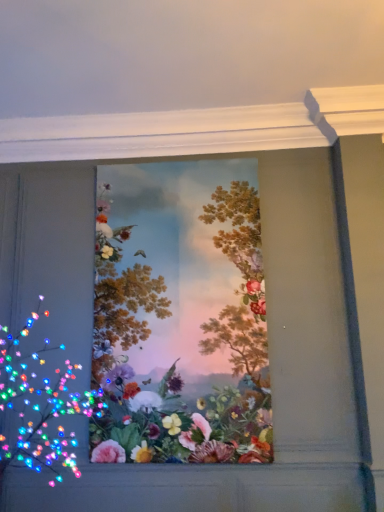
The height and width of the screenshot is (512, 384). In order to click on matte floral arrangement at left, which is counted as the first flower, starting from the front in this screenshot , I will do `click(38, 404)`.

Describe the element at coordinates (38, 404) in the screenshot. The height and width of the screenshot is (512, 384). I see `matte floral arrangement at left, which is counted as the first flower, starting from the front` at that location.

Measure the distance between matte floral arrangement at left, which is counted as the first flower, starting from the front, and camera.

A distance of 2.49 meters exists between matte floral arrangement at left, which is counted as the first flower, starting from the front, and camera.

How much space does matte floral arrangement at left, which is the second flower from back to front, occupy horizontally?

matte floral arrangement at left, which is the second flower from back to front, is 3.78 feet wide.

I want to click on vibrant floral bouquet at center, positioned as the 1th flower in back-to-front order, so click(179, 358).

In the scene shown: What is the approximate width of vibrant floral bouquet at center, the 2th flower when ordered from front to back?

The width of vibrant floral bouquet at center, the 2th flower when ordered from front to back, is 2.49 inches.

Image resolution: width=384 pixels, height=512 pixels. Describe the element at coordinates (179, 358) in the screenshot. I see `vibrant floral bouquet at center, positioned as the 1th flower in back-to-front order` at that location.

What is the approximate height of vibrant floral bouquet at center, the 2th flower when ordered from front to back?

7.84 feet.

Measure the distance between point (155, 451) and camera.

The depth of point (155, 451) is 3.15 meters.

Find the location of a particular element. The image size is (384, 512). matte floral arrangement at left, which is counted as the first flower, starting from the front is located at coordinates [38, 404].

Is vibrant floral bouquet at center, the 2th flower when ordered from front to back, at the right side of matte floral arrangement at left, which is counted as the first flower, starting from the front?

Indeed, vibrant floral bouquet at center, the 2th flower when ordered from front to back, is positioned on the right side of matte floral arrangement at left, which is counted as the first flower, starting from the front.

Is vibrant floral bouquet at center, the 2th flower when ordered from front to back, in front of or behind matte floral arrangement at left, which is the second flower from back to front, in the image?

vibrant floral bouquet at center, the 2th flower when ordered from front to back, is behind matte floral arrangement at left, which is the second flower from back to front.

Does point (104, 338) lie in front of point (8, 404)?

No, it is not.

From the image's perspective, between vibrant floral bouquet at center, the 2th flower when ordered from front to back, and matte floral arrangement at left, which is counted as the first flower, starting from the front, which one is located above?

vibrant floral bouquet at center, the 2th flower when ordered from front to back, appears higher in the image.

From a real-world perspective, which object rests below the other?

matte floral arrangement at left, which is the second flower from back to front, is physically lower.

Considering the sizes of vibrant floral bouquet at center, the 2th flower when ordered from front to back, and matte floral arrangement at left, which is the second flower from back to front, in the image, is vibrant floral bouquet at center, the 2th flower when ordered from front to back, wider or thinner than matte floral arrangement at left, which is the second flower from back to front,?

vibrant floral bouquet at center, the 2th flower when ordered from front to back, is thinner than matte floral arrangement at left, which is the second flower from back to front.

Considering the sizes of objects vibrant floral bouquet at center, positioned as the 1th flower in back-to-front order, and matte floral arrangement at left, which is the second flower from back to front, in the image provided, who is shorter, vibrant floral bouquet at center, positioned as the 1th flower in back-to-front order, or matte floral arrangement at left, which is the second flower from back to front,?

matte floral arrangement at left, which is the second flower from back to front.

Considering the sizes of objects vibrant floral bouquet at center, positioned as the 1th flower in back-to-front order, and matte floral arrangement at left, which is the second flower from back to front, in the image provided, who is bigger, vibrant floral bouquet at center, positioned as the 1th flower in back-to-front order, or matte floral arrangement at left, which is the second flower from back to front,?

matte floral arrangement at left, which is the second flower from back to front.

Is vibrant floral bouquet at center, the 2th flower when ordered from front to back, completely or partially outside of matte floral arrangement at left, which is the second flower from back to front?

Indeed, vibrant floral bouquet at center, the 2th flower when ordered from front to back, is completely outside matte floral arrangement at left, which is the second flower from back to front.

Is vibrant floral bouquet at center, positioned as the 1th flower in back-to-front order, positioned far away from matte floral arrangement at left, which is counted as the first flower, starting from the front?

No, vibrant floral bouquet at center, positioned as the 1th flower in back-to-front order, is not far away from matte floral arrangement at left, which is counted as the first flower, starting from the front.

Is vibrant floral bouquet at center, the 2th flower when ordered from front to back, looking in the opposite direction of matte floral arrangement at left, which is the second flower from back to front?

No.

What's the angular difference between vibrant floral bouquet at center, positioned as the 1th flower in back-to-front order, and matte floral arrangement at left, which is the second flower from back to front,'s facing directions?

There is a 90.3-degree angle between the facing directions of vibrant floral bouquet at center, positioned as the 1th flower in back-to-front order, and matte floral arrangement at left, which is the second flower from back to front.

At what (x,y) coordinates should I click in order to perform the action: click on flower beneath the vibrant floral bouquet at center, the 2th flower when ordered from front to back (from a real-world perspective). Please return your answer as a coordinate pair (x, y). The image size is (384, 512). Looking at the image, I should click on point(38,404).

Which object is positioned more to the left, matte floral arrangement at left, which is the second flower from back to front, or vibrant floral bouquet at center, positioned as the 1th flower in back-to-front order?

matte floral arrangement at left, which is the second flower from back to front.

Does matte floral arrangement at left, which is counted as the first flower, starting from the front, come in front of vibrant floral bouquet at center, the 2th flower when ordered from front to back?

Yes.

Which is behind, point (66, 466) or point (116, 261)?

The point (116, 261) is farther.

Looking at this image, from the image's perspective, would you say matte floral arrangement at left, which is counted as the first flower, starting from the front, is shown under vibrant floral bouquet at center, the 2th flower when ordered from front to back?

Correct, matte floral arrangement at left, which is counted as the first flower, starting from the front, appears lower than vibrant floral bouquet at center, the 2th flower when ordered from front to back, in the image.

From a real-world perspective, is matte floral arrangement at left, which is counted as the first flower, starting from the front, physically above vibrant floral bouquet at center, the 2th flower when ordered from front to back?

No.

Considering the sizes of objects matte floral arrangement at left, which is counted as the first flower, starting from the front, and vibrant floral bouquet at center, the 2th flower when ordered from front to back, in the image provided, who is thinner, matte floral arrangement at left, which is counted as the first flower, starting from the front, or vibrant floral bouquet at center, the 2th flower when ordered from front to back,?

With smaller width is vibrant floral bouquet at center, the 2th flower when ordered from front to back.

Does matte floral arrangement at left, which is the second flower from back to front, have a greater height compared to vibrant floral bouquet at center, the 2th flower when ordered from front to back?

Incorrect, the height of matte floral arrangement at left, which is the second flower from back to front, is not larger of that of vibrant floral bouquet at center, the 2th flower when ordered from front to back.

Can you confirm if matte floral arrangement at left, which is counted as the first flower, starting from the front, is smaller than vibrant floral bouquet at center, positioned as the 1th flower in back-to-front order?

Incorrect, matte floral arrangement at left, which is counted as the first flower, starting from the front, is not smaller in size than vibrant floral bouquet at center, positioned as the 1th flower in back-to-front order.

Is matte floral arrangement at left, which is the second flower from back to front, located outside vibrant floral bouquet at center, the 2th flower when ordered from front to back?

Yes, matte floral arrangement at left, which is the second flower from back to front, is outside of vibrant floral bouquet at center, the 2th flower when ordered from front to back.

Is matte floral arrangement at left, which is the second flower from back to front, beside vibrant floral bouquet at center, the 2th flower when ordered from front to back?

No, matte floral arrangement at left, which is the second flower from back to front, is not in contact with vibrant floral bouquet at center, the 2th flower when ordered from front to back.

Is matte floral arrangement at left, which is the second flower from back to front, facing away from vibrant floral bouquet at center, the 2th flower when ordered from front to back?

No, vibrant floral bouquet at center, the 2th flower when ordered from front to back, is not at the back of matte floral arrangement at left, which is the second flower from back to front.

What's the angular difference between matte floral arrangement at left, which is counted as the first flower, starting from the front, and vibrant floral bouquet at center, positioned as the 1th flower in back-to-front order,'s facing directions?

The angular difference between matte floral arrangement at left, which is counted as the first flower, starting from the front, and vibrant floral bouquet at center, positioned as the 1th flower in back-to-front order, is 90.3 degrees.

Measure the distance between matte floral arrangement at left, which is counted as the first flower, starting from the front, and vibrant floral bouquet at center, positioned as the 1th flower in back-to-front order.

They are 24.55 inches apart.

Where is `flower that appears behind the matte floral arrangement at left, which is the second flower from back to front`? The width and height of the screenshot is (384, 512). flower that appears behind the matte floral arrangement at left, which is the second flower from back to front is located at coordinates (179, 358).

Identify the location of flower above the matte floral arrangement at left, which is counted as the first flower, starting from the front (from the image's perspective). (179, 358).

At what (x,y) coordinates should I click in order to perform the action: click on flower on the right side of matte floral arrangement at left, which is counted as the first flower, starting from the front. Please return your answer as a coordinate pair (x, y). The height and width of the screenshot is (512, 384). Looking at the image, I should click on (179, 358).